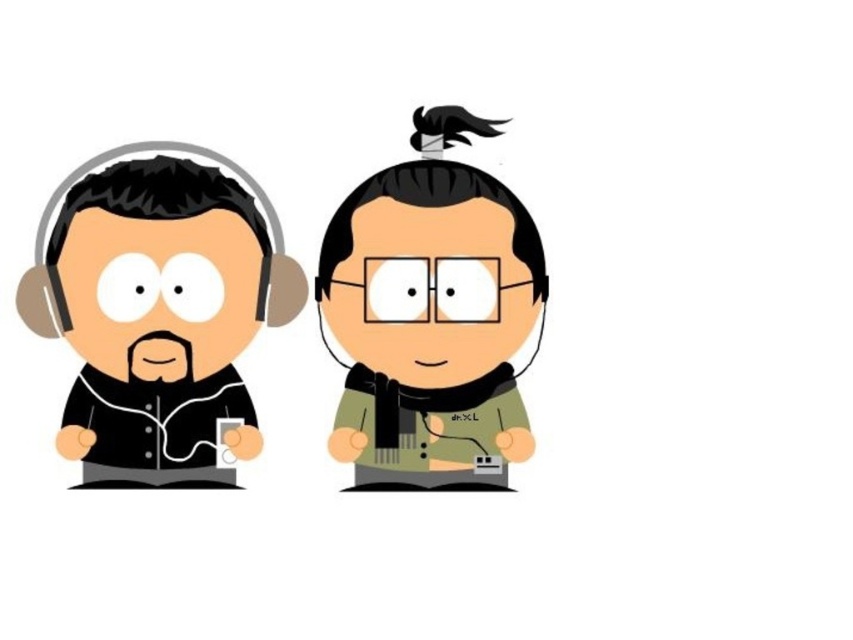
Question: In this image, where is black matte headphones at left located relative to green matte scarf at center?

Choices:
 (A) right
 (B) left

Answer: (B)

Question: Among these points, which one is nearest to the camera?

Choices:
 (A) (445, 212)
 (B) (140, 214)

Answer: (B)

Question: Among these objects, which one is nearest to the camera?

Choices:
 (A) black matte headphones at left
 (B) green matte scarf at center

Answer: (A)

Question: Considering the relative positions of black matte headphones at left and green matte scarf at center in the image provided, where is black matte headphones at left located with respect to green matte scarf at center?

Choices:
 (A) below
 (B) above

Answer: (A)

Question: Does black matte headphones at left appear over green matte scarf at center?

Choices:
 (A) no
 (B) yes

Answer: (A)

Question: Which point is closer to the camera?

Choices:
 (A) green matte scarf at center
 (B) black matte headphones at left

Answer: (B)